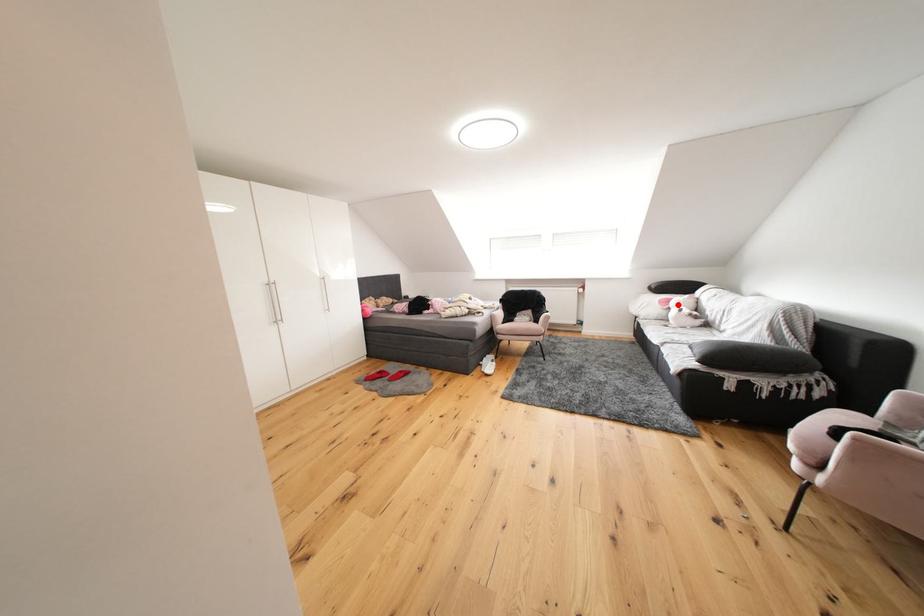
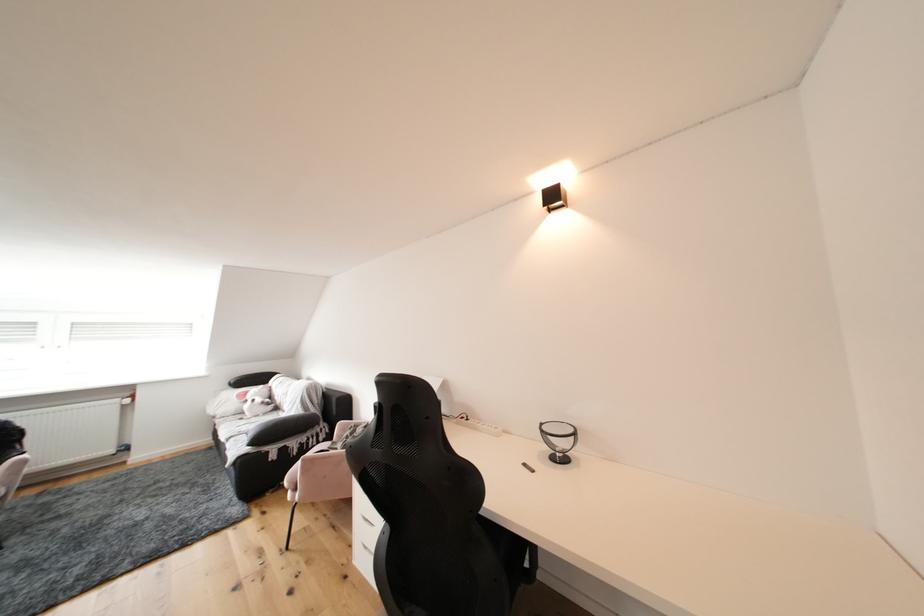
Question: I am providing you with two images of the same scene from different viewpoints. In image1, a red point is highlighted. Considering the same 3D point in image2, which of the following is correct?

Choices:
 (A) It is closer
 (B) It is farther

Answer: (B)